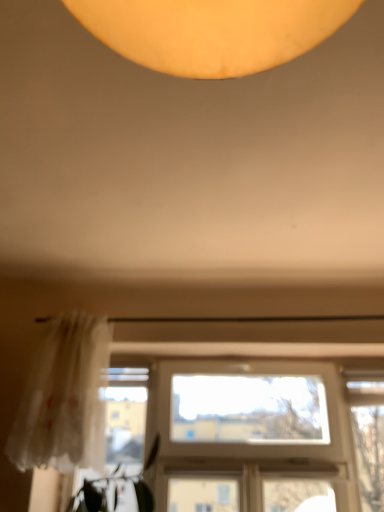
Question: Considering the positions of clear glass window at center and translucent white curtain at left in the image, is clear glass window at center wider or thinner than translucent white curtain at left?

Choices:
 (A) wide
 (B) thin

Answer: (B)

Question: Considering their positions, is clear glass window at center located in front of or behind translucent white curtain at left?

Choices:
 (A) behind
 (B) front

Answer: (A)

Question: From a real-world perspective, is clear glass window at center above or below translucent white curtain at left?

Choices:
 (A) above
 (B) below

Answer: (B)

Question: Considering the positions of translucent white curtain at left and clear glass window at center in the image, is translucent white curtain at left bigger or smaller than clear glass window at center?

Choices:
 (A) small
 (B) big

Answer: (A)

Question: Considering the positions of translucent white curtain at left and clear glass window at center in the image, is translucent white curtain at left taller or shorter than clear glass window at center?

Choices:
 (A) tall
 (B) short

Answer: (B)

Question: Considering the positions of translucent white curtain at left and clear glass window at center in the image, is translucent white curtain at left wider or thinner than clear glass window at center?

Choices:
 (A) thin
 (B) wide

Answer: (B)

Question: Is point (69, 453) closer or farther from the camera than point (182, 377)?

Choices:
 (A) farther
 (B) closer

Answer: (B)